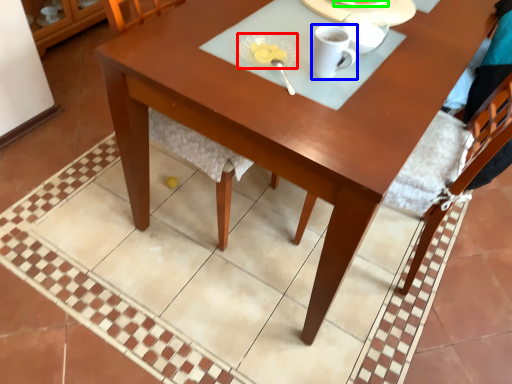
Question: Which is farther away from tableware (highlighted by a red box)? coffee cup (highlighted by a blue box) or tableware (highlighted by a green box)?

Choices:
 (A) coffee cup
 (B) tableware

Answer: (B)